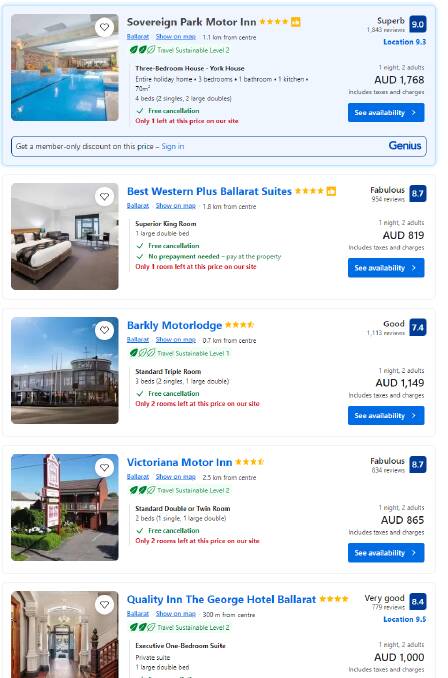
You are a GUI agent. You are given a task and a screenshot of the screen. Output one action in this format:
    pyautogui.click(x=<x>, y=<y>)
    Task: Click on the bed
    This screenshot has height=678, width=448.
    Given the screenshot: What is the action you would take?
    pyautogui.click(x=48, y=254)